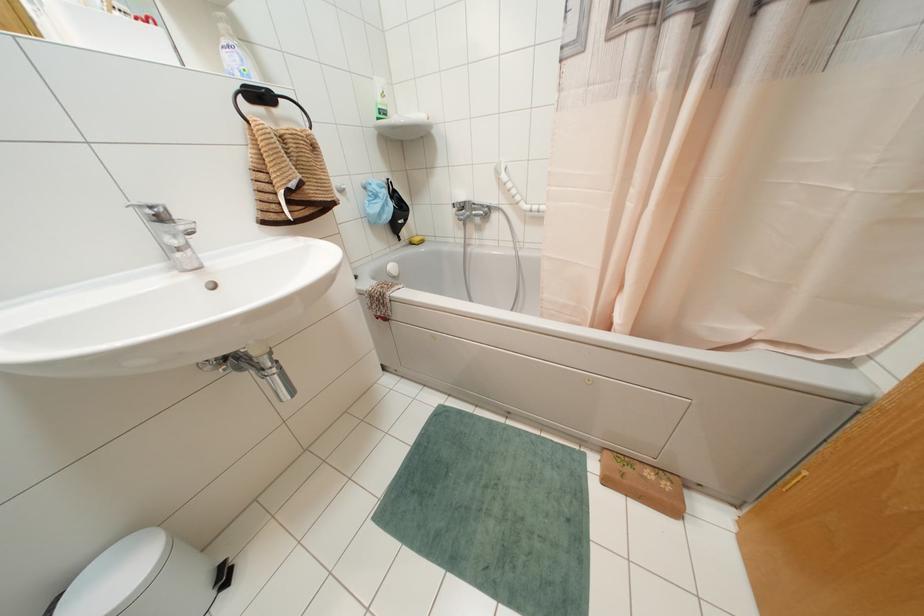
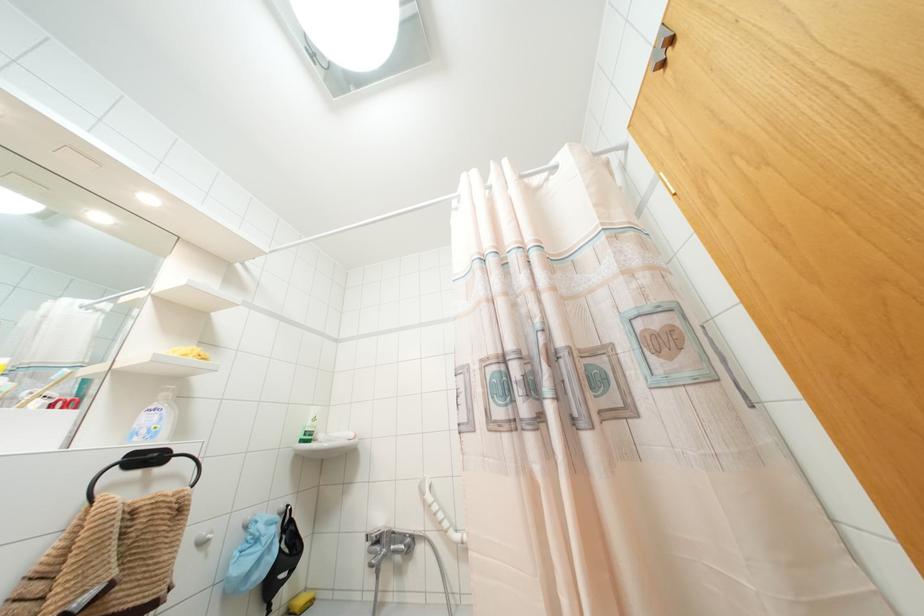
In the second image, find the point that corresponds to (x=236, y=57) in the first image.

(154, 418)